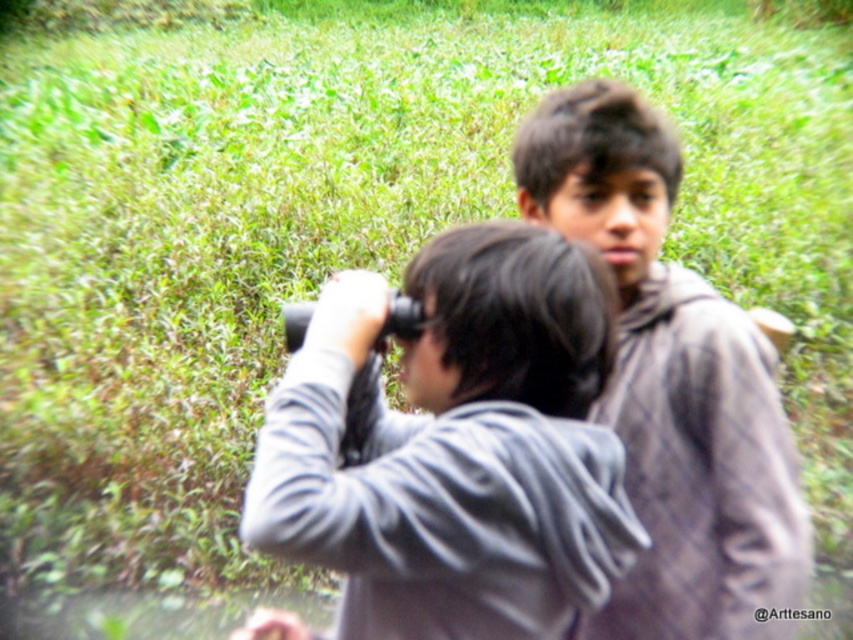
Is gray matte jacket at center taller than gray woolen sweater at center?

Incorrect, gray matte jacket at center's height is not larger of gray woolen sweater at center's.

Looking at this image, does gray matte jacket at center have a greater width compared to gray woolen sweater at center?

Yes, gray matte jacket at center is wider than gray woolen sweater at center.

Is point (427, 540) farther from camera compared to point (709, 364)?

No, it is not.

What are the coordinates of `gray matte jacket at center` in the screenshot? It's located at (456, 445).